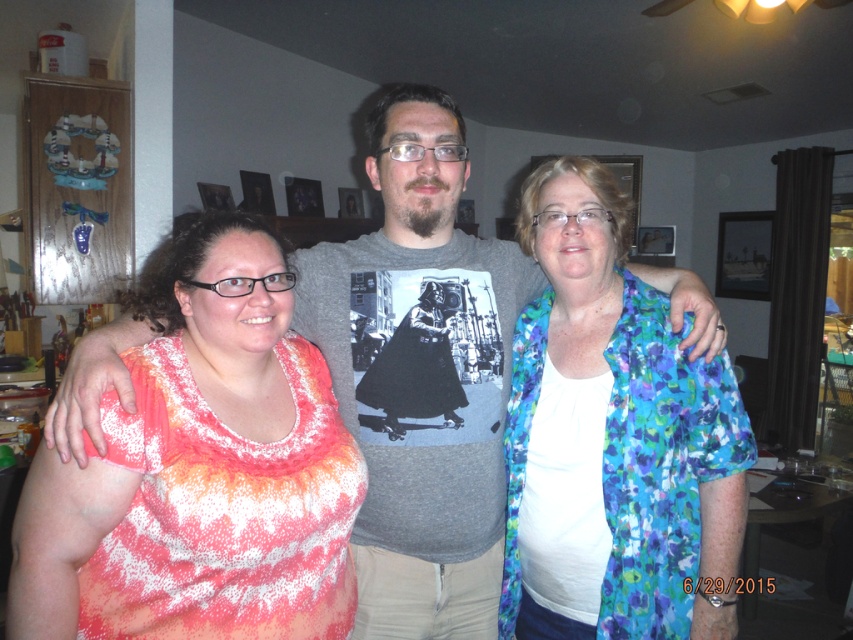
Does point (682, 556) come in front of point (428, 554)?

Yes, it is in front of point (428, 554).

Who is more distant from viewer, (671, 472) or (335, 394)?

The point (335, 394) is more distant.

The height and width of the screenshot is (640, 853). I want to click on blue floral shirt at center, so click(610, 433).

Is point (135, 512) positioned after point (477, 572)?

No, it is not.

Does tie-dye fabric shirt at left appear on the left side of gray cotton t-shirt at center?

Yes, tie-dye fabric shirt at left is to the left of gray cotton t-shirt at center.

What do you see at coordinates (201, 470) in the screenshot? I see `tie-dye fabric shirt at left` at bounding box center [201, 470].

At what (x,y) coordinates should I click in order to perform the action: click on tie-dye fabric shirt at left. Please return your answer as a coordinate pair (x, y). This screenshot has width=853, height=640. Looking at the image, I should click on [x=201, y=470].

Is tie-dye fabric shirt at left shorter than blue floral shirt at center?

Yes, tie-dye fabric shirt at left is shorter than blue floral shirt at center.

The image size is (853, 640). Describe the element at coordinates (201, 470) in the screenshot. I see `tie-dye fabric shirt at left` at that location.

Is point (136, 636) in front of point (606, 509)?

Yes.

Image resolution: width=853 pixels, height=640 pixels. In order to click on tie-dye fabric shirt at left in this screenshot , I will do `click(201, 470)`.